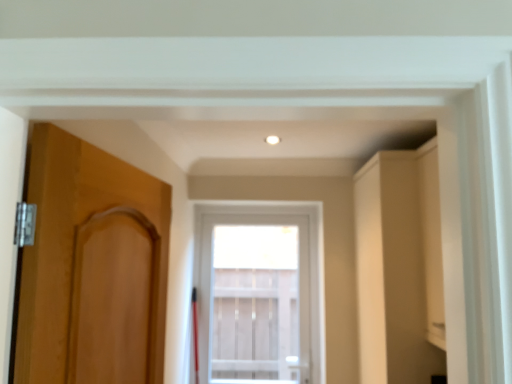
Question: Considering their positions, is matte beige cabinet at right located in front of or behind clear glass window at center?

Choices:
 (A) front
 (B) behind

Answer: (A)

Question: Is matte beige cabinet at right taller or shorter than clear glass window at center?

Choices:
 (A) short
 (B) tall

Answer: (B)

Question: Which is farther from the clear glass window at center?

Choices:
 (A) matte beige cabinet at right
 (B) matte wood door at left

Answer: (B)

Question: Which object is positioned farthest from the matte beige cabinet at right?

Choices:
 (A) clear glass window at center
 (B) matte wood door at left

Answer: (A)